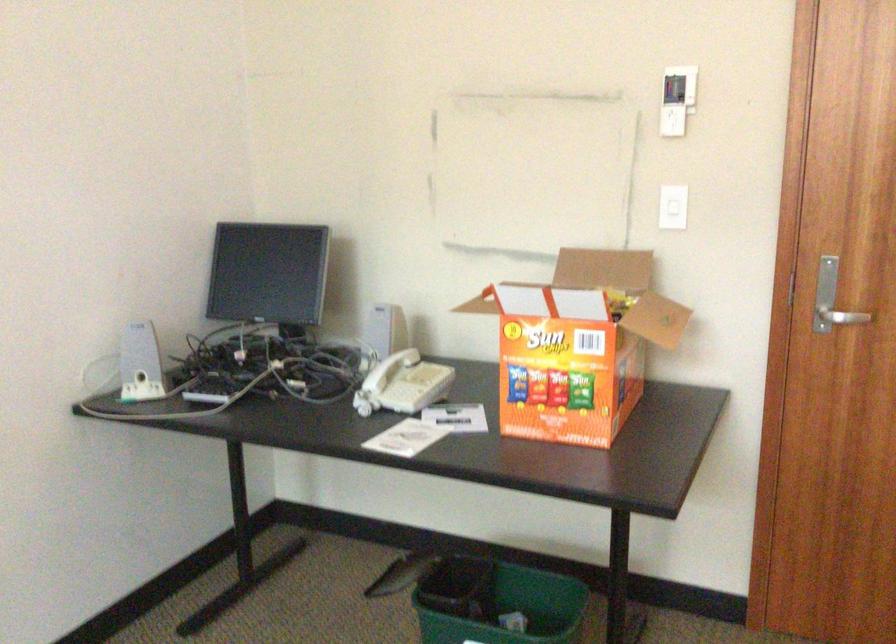
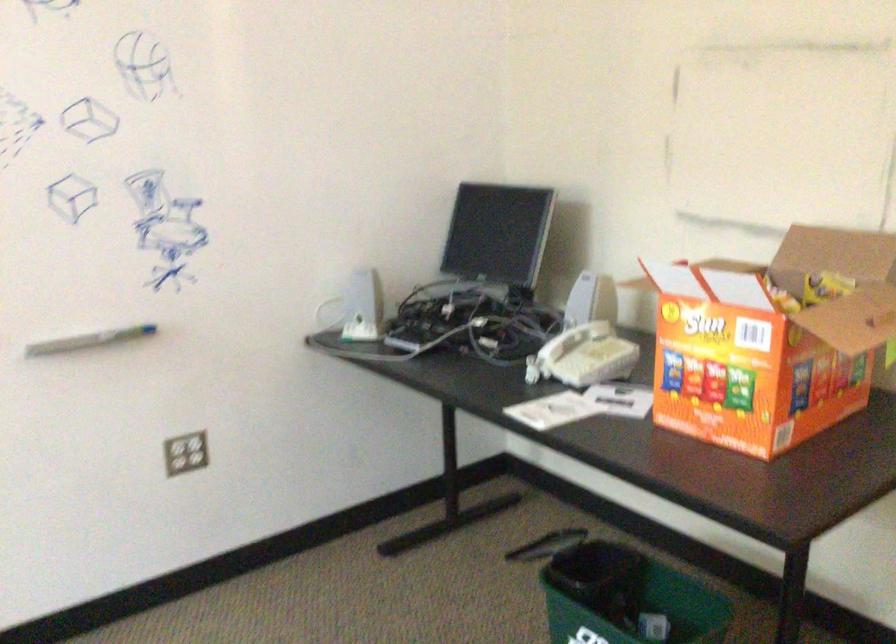
The point at (616,301) is marked in the first image. Where is the corresponding point in the second image?

(824, 287)